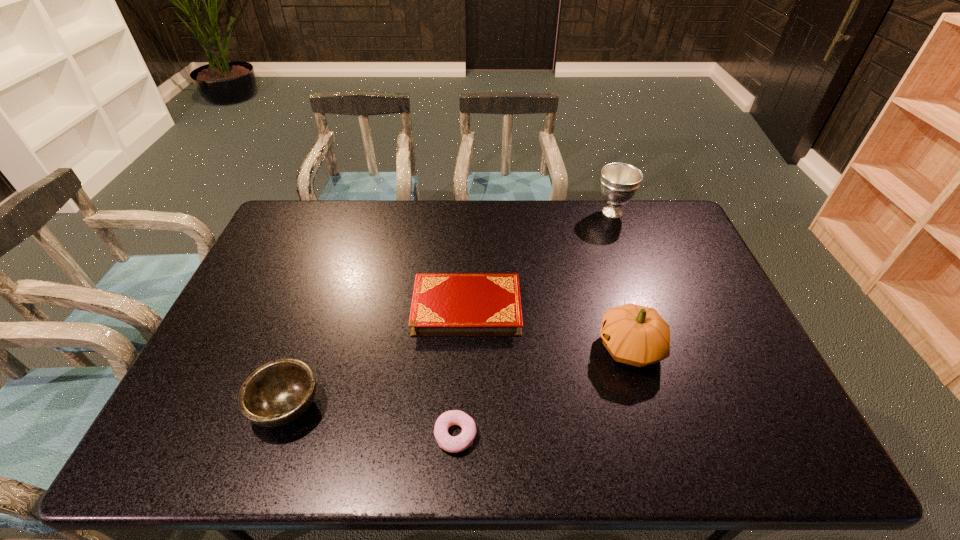
The image size is (960, 540). I want to click on the farthest object, so click(x=619, y=182).

Identify the location of gourd. The width and height of the screenshot is (960, 540). (633, 334).

This screenshot has width=960, height=540. In order to click on bowl in this screenshot , I will do `click(277, 393)`.

At what (x,y) coordinates should I click in order to perform the action: click on the third shortest object. Please return your answer as a coordinate pair (x, y). The width and height of the screenshot is (960, 540). Looking at the image, I should click on pos(277,393).

The width and height of the screenshot is (960, 540). Identify the location of the fourth tallest object. (444, 304).

Find the location of a particular element. doughnut is located at coordinates (459, 443).

What are the coordinates of `free space located 0.110m on the left of the chalice` in the screenshot? It's located at (564, 212).

Where is `vacant space positioned on the side of the gourd with the carved face`? Image resolution: width=960 pixels, height=540 pixels. vacant space positioned on the side of the gourd with the carved face is located at coordinates (479, 348).

At what (x,y) coordinates should I click in order to perform the action: click on blank area located on the side of the gourd with the carved face. Please return your answer as a coordinate pair (x, y). Looking at the image, I should click on (475, 348).

Where is `vacant space situated on the side of the gourd with the carved face`? The height and width of the screenshot is (540, 960). vacant space situated on the side of the gourd with the carved face is located at coordinates (464, 348).